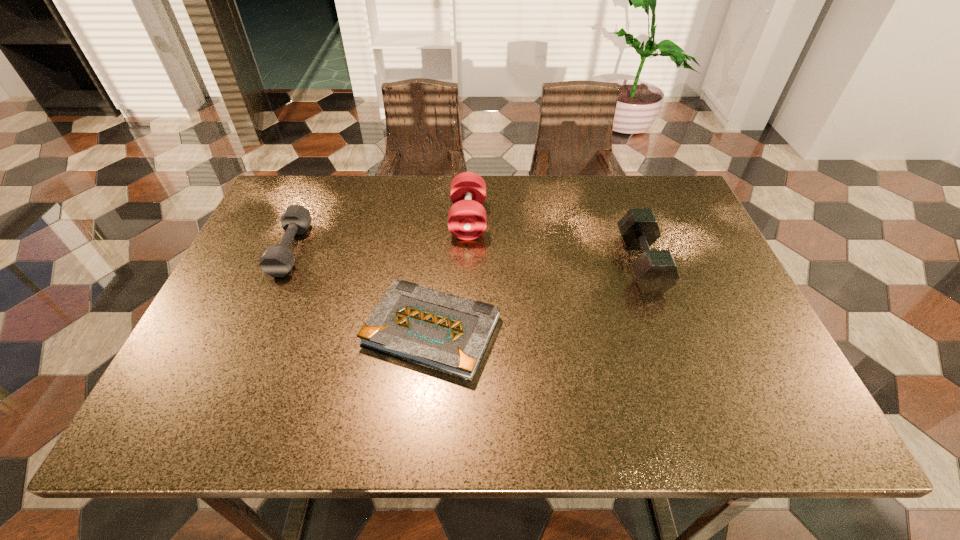
Locate which object ranks third in proximity to the second dumbbell from right to left. Please provide its 2D coordinates. Your answer should be formatted as a tuple, i.e. [(x, y)], where the tuple contains the x and y coordinates of a point satisfying the conditions above.

[(277, 260)]

Select which object is the second closest to the second dumbbell from right to left. Please provide its 2D coordinates. Your answer should be formatted as a tuple, i.e. [(x, y)], where the tuple contains the x and y coordinates of a point satisfying the conditions above.

[(656, 272)]

At what (x,y) coordinates should I click in order to perform the action: click on dumbbell that stands as the closest to the shortest dumbbell. Please return your answer as a coordinate pair (x, y). Looking at the image, I should click on (467, 220).

Identify which dumbbell is the second closest to the shortest dumbbell. Please provide its 2D coordinates. Your answer should be formatted as a tuple, i.e. [(x, y)], where the tuple contains the x and y coordinates of a point satisfying the conditions above.

[(656, 272)]

Find the location of `free point that satisfies the following two spatial constraints: 1. on the back side of the notebook; 2. on the right side of the second dumbbell from right to left`. free point that satisfies the following two spatial constraints: 1. on the back side of the notebook; 2. on the right side of the second dumbbell from right to left is located at coordinates (443, 220).

Image resolution: width=960 pixels, height=540 pixels. What are the coordinates of `blank space that satisfies the following two spatial constraints: 1. on the back side of the shortest object; 2. on the right side of the rightmost object` in the screenshot? It's located at (438, 264).